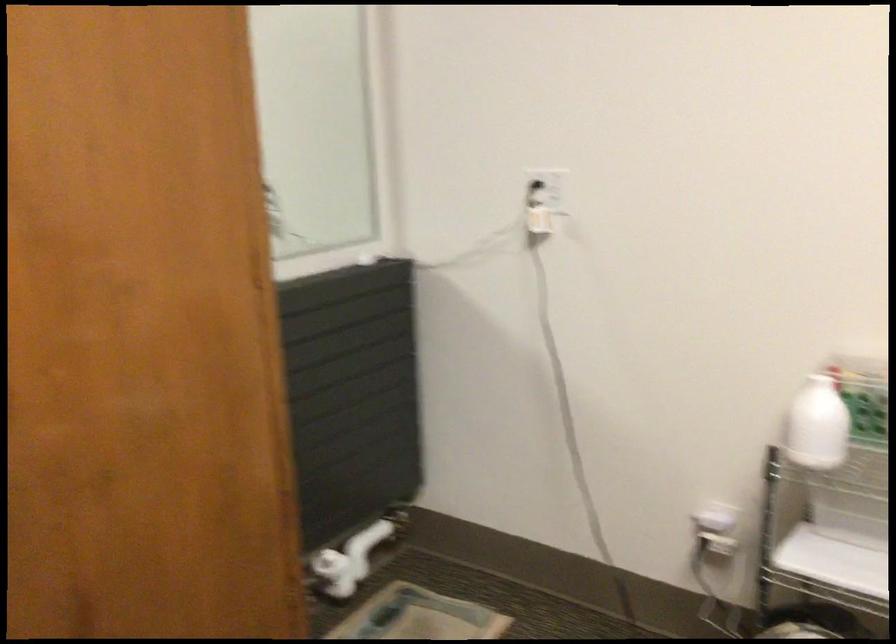
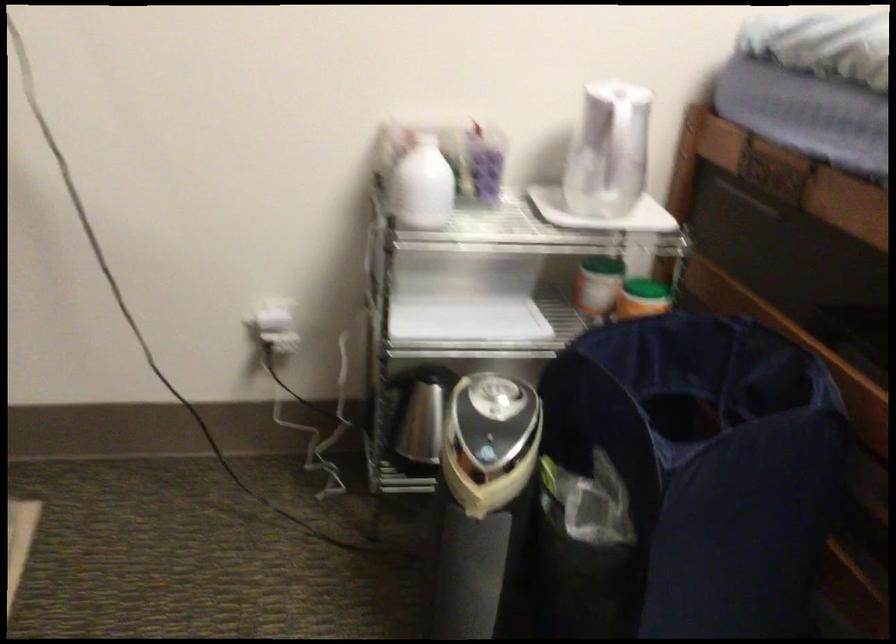
In the second image, find the point that corresponds to point 810,429 in the first image.

(421, 185)